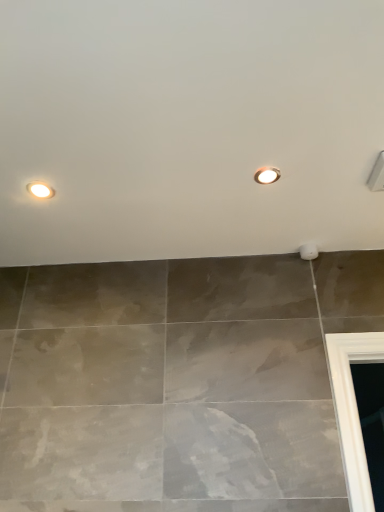
What do you see at coordinates (267, 175) in the screenshot? I see `matte white droplight at upper center, the 1th droplight when ordered from top to bottom` at bounding box center [267, 175].

Identify the location of matte white droplight at upper center, acting as the second droplight starting from the left. Image resolution: width=384 pixels, height=512 pixels. (267, 175).

Describe the element at coordinates (40, 190) in the screenshot. Image resolution: width=384 pixels, height=512 pixels. I see `matte white droplight at upper left, which is the first droplight in bottom-to-top order` at that location.

In order to click on matte white droplight at upper left, the 1th droplight in the left-to-right sequence in this screenshot , I will do `click(40, 190)`.

The height and width of the screenshot is (512, 384). I want to click on matte white droplight at upper center, acting as the second droplight starting from the left, so click(x=267, y=175).

Does matte white droplight at upper left, the 1th droplight in the left-to-right sequence, appear on the left side of matte white droplight at upper center, which appears as the second droplight when ordered from the bottom?

Indeed, matte white droplight at upper left, the 1th droplight in the left-to-right sequence, is positioned on the left side of matte white droplight at upper center, which appears as the second droplight when ordered from the bottom.

Which object is closer to the camera taking this photo, matte white droplight at upper left, the 1th droplight in the left-to-right sequence, or matte white droplight at upper center, which appears as the second droplight when ordered from the bottom?

matte white droplight at upper center, which appears as the second droplight when ordered from the bottom.

Considering the positions of point (39, 183) and point (271, 179), is point (39, 183) closer or farther from the camera than point (271, 179)?

Point (39, 183) appears to be farther away from the viewer than point (271, 179).

From the image's perspective, is matte white droplight at upper left, which is the first droplight in bottom-to-top order, positioned above or below matte white droplight at upper center, acting as the second droplight starting from the left?

matte white droplight at upper left, which is the first droplight in bottom-to-top order, is below matte white droplight at upper center, acting as the second droplight starting from the left.

From a real-world perspective, is matte white droplight at upper left, which is the first droplight in bottom-to-top order, located higher than matte white droplight at upper center, acting as the 1th droplight starting from the right?

No, from a real-world perspective, matte white droplight at upper left, which is the first droplight in bottom-to-top order, is not over matte white droplight at upper center, acting as the 1th droplight starting from the right

Which of these two, matte white droplight at upper left, the 2th droplight positioned from the right, or matte white droplight at upper center, which appears as the second droplight when ordered from the bottom, is wider?

Wider between the two is matte white droplight at upper left, the 2th droplight positioned from the right.

Who is taller, matte white droplight at upper left, the second droplight in the top-to-bottom sequence, or matte white droplight at upper center, the 1th droplight when ordered from top to bottom?

With more height is matte white droplight at upper left, the second droplight in the top-to-bottom sequence.

Which of these two, matte white droplight at upper left, the second droplight in the top-to-bottom sequence, or matte white droplight at upper center, acting as the second droplight starting from the left, is smaller?

Smaller between the two is matte white droplight at upper center, acting as the second droplight starting from the left.

Is matte white droplight at upper left, the second droplight in the top-to-bottom sequence, located outside matte white droplight at upper center, which appears as the second droplight when ordered from the bottom?

matte white droplight at upper left, the second droplight in the top-to-bottom sequence, lies outside matte white droplight at upper center, which appears as the second droplight when ordered from the bottom,'s area.

Is matte white droplight at upper left, the 1th droplight in the left-to-right sequence, far away from matte white droplight at upper center, which appears as the second droplight when ordered from the bottom?

No, matte white droplight at upper left, the 1th droplight in the left-to-right sequence, is not far from matte white droplight at upper center, which appears as the second droplight when ordered from the bottom.

Is matte white droplight at upper left, the 1th droplight in the left-to-right sequence, looking in the opposite direction of matte white droplight at upper center, acting as the 1th droplight starting from the right?

No, matte white droplight at upper left, the 1th droplight in the left-to-right sequence, is not facing away from matte white droplight at upper center, acting as the 1th droplight starting from the right.

Locate an element on the screen. droplight to the left of matte white droplight at upper center, acting as the 1th droplight starting from the right is located at coordinates (40, 190).

In the scene shown: Considering the relative positions of matte white droplight at upper center, the 1th droplight when ordered from top to bottom, and matte white droplight at upper left, the second droplight in the top-to-bottom sequence, in the image provided, is matte white droplight at upper center, the 1th droplight when ordered from top to bottom, to the left of matte white droplight at upper left, the second droplight in the top-to-bottom sequence, from the viewer's perspective?

No.

Is matte white droplight at upper center, acting as the second droplight starting from the left, in front of or behind matte white droplight at upper left, which is the first droplight in bottom-to-top order, in the image?

matte white droplight at upper center, acting as the second droplight starting from the left, is positioned closer to the viewer than matte white droplight at upper left, which is the first droplight in bottom-to-top order.

Between point (277, 174) and point (52, 191), which one is positioned in front?

Point (277, 174)

Consider the image. From the image's perspective, which one is positioned lower, matte white droplight at upper center, acting as the 1th droplight starting from the right, or matte white droplight at upper left, the second droplight in the top-to-bottom sequence?

matte white droplight at upper left, the second droplight in the top-to-bottom sequence, appears lower in the image.

From a real-world perspective, is matte white droplight at upper center, the 1th droplight when ordered from top to bottom, physically located above or below matte white droplight at upper left, the 1th droplight in the left-to-right sequence?

Clearly, from a real-world perspective, matte white droplight at upper center, the 1th droplight when ordered from top to bottom, is above matte white droplight at upper left, the 1th droplight in the left-to-right sequence.

Considering the sizes of matte white droplight at upper center, the 1th droplight when ordered from top to bottom, and matte white droplight at upper left, the second droplight in the top-to-bottom sequence, in the image, is matte white droplight at upper center, the 1th droplight when ordered from top to bottom, wider or thinner than matte white droplight at upper left, the second droplight in the top-to-bottom sequence,?

matte white droplight at upper center, the 1th droplight when ordered from top to bottom, is thinner than matte white droplight at upper left, the second droplight in the top-to-bottom sequence.

Considering the sizes of matte white droplight at upper center, acting as the 1th droplight starting from the right, and matte white droplight at upper left, the 1th droplight in the left-to-right sequence, in the image, is matte white droplight at upper center, acting as the 1th droplight starting from the right, taller or shorter than matte white droplight at upper left, the 1th droplight in the left-to-right sequence,?

Clearly, matte white droplight at upper center, acting as the 1th droplight starting from the right, is shorter compared to matte white droplight at upper left, the 1th droplight in the left-to-right sequence.

Looking at the image, does matte white droplight at upper center, acting as the 1th droplight starting from the right, seem bigger or smaller compared to matte white droplight at upper left, which is the first droplight in bottom-to-top order?

Considering their sizes, matte white droplight at upper center, acting as the 1th droplight starting from the right, takes up less space than matte white droplight at upper left, which is the first droplight in bottom-to-top order.

Is matte white droplight at upper left, the second droplight in the top-to-bottom sequence, surrounded by matte white droplight at upper center, which appears as the second droplight when ordered from the bottom?

No, matte white droplight at upper left, the second droplight in the top-to-bottom sequence, is not inside matte white droplight at upper center, which appears as the second droplight when ordered from the bottom.

Is matte white droplight at upper center, acting as the 1th droplight starting from the right, with matte white droplight at upper left, which is the first droplight in bottom-to-top order?

matte white droplight at upper center, acting as the 1th droplight starting from the right, is not next to matte white droplight at upper left, which is the first droplight in bottom-to-top order, and they're not touching.

Could you tell me if matte white droplight at upper center, the 1th droplight when ordered from top to bottom, is turned towards matte white droplight at upper left, the 2th droplight positioned from the right?

No, matte white droplight at upper center, the 1th droplight when ordered from top to bottom, does not turn towards matte white droplight at upper left, the 2th droplight positioned from the right.

This screenshot has width=384, height=512. I want to click on droplight below the matte white droplight at upper center, acting as the second droplight starting from the left (from the image's perspective), so click(x=40, y=190).

Identify the location of droplight located above the matte white droplight at upper left, the 1th droplight in the left-to-right sequence (from the image's perspective). The image size is (384, 512). (267, 175).

Find the location of `droplight to the left of matte white droplight at upper center, acting as the 1th droplight starting from the right`. droplight to the left of matte white droplight at upper center, acting as the 1th droplight starting from the right is located at coordinates (40, 190).